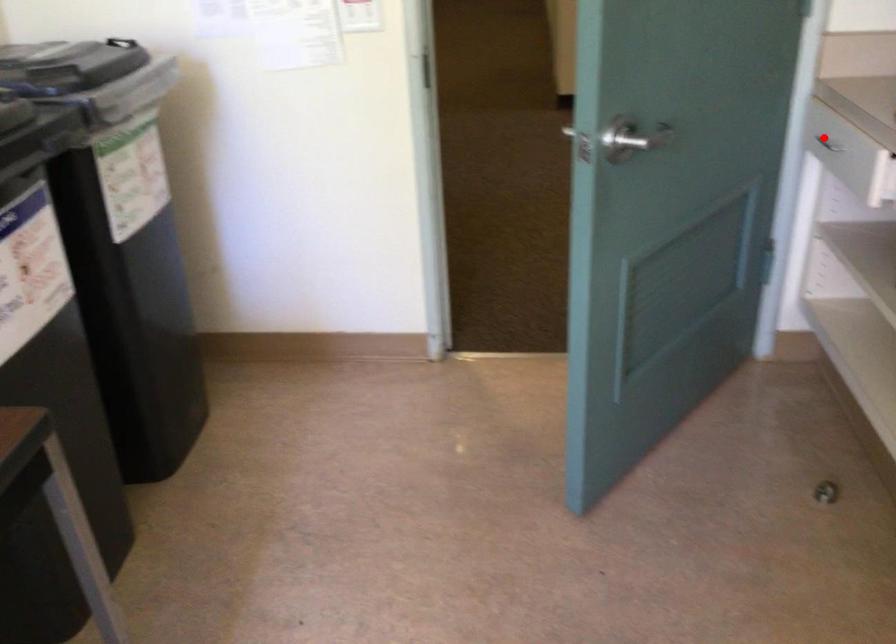
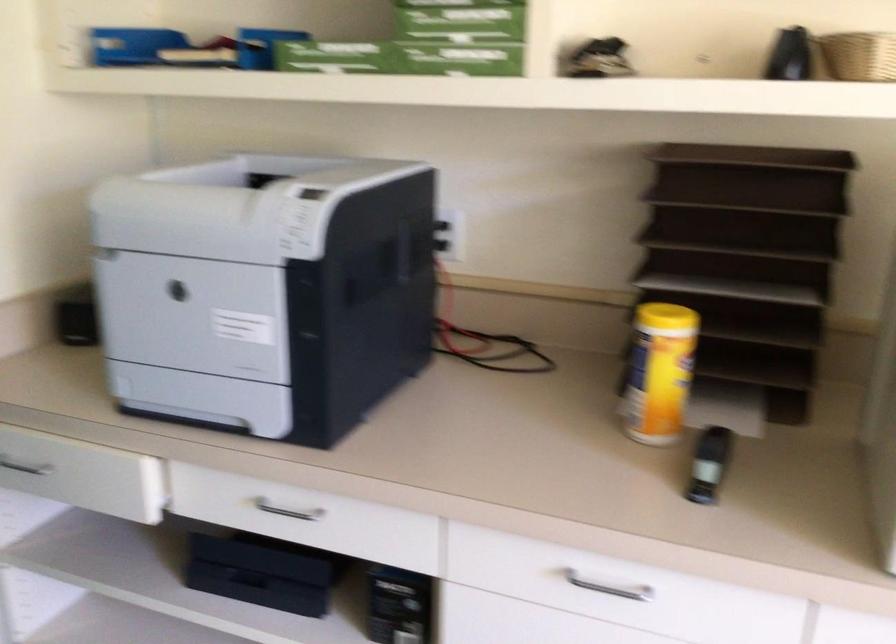
Question: I am providing you with two images of the same scene from different viewpoints. A red point is marked on the first image. Can you still see the location of the red point in image 2?

Choices:
 (A) Yes
 (B) No

Answer: (A)